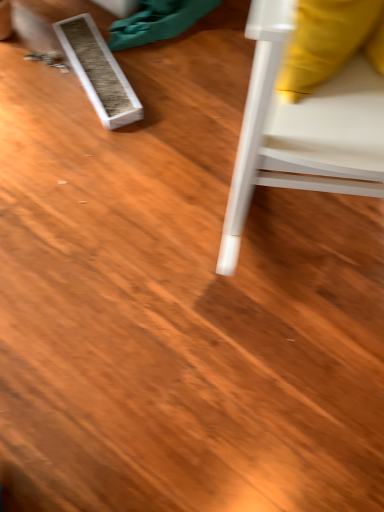
Question: Is white plastic chair at right outside white textured box at upper left?

Choices:
 (A) no
 (B) yes

Answer: (B)

Question: Could you tell me if white plastic chair at right is facing white textured box at upper left?

Choices:
 (A) no
 (B) yes

Answer: (A)

Question: Does white plastic chair at right have a smaller size compared to white textured box at upper left?

Choices:
 (A) yes
 (B) no

Answer: (B)

Question: Considering the relative positions of white plastic chair at right and white textured box at upper left in the image provided, is white plastic chair at right to the right of white textured box at upper left from the viewer's perspective?

Choices:
 (A) yes
 (B) no

Answer: (A)

Question: From a real-world perspective, does white plastic chair at right sit lower than white textured box at upper left?

Choices:
 (A) no
 (B) yes

Answer: (A)

Question: Is white plastic chair at right oriented away from white textured box at upper left?

Choices:
 (A) no
 (B) yes

Answer: (A)

Question: Is the surface of white textured box at upper left in direct contact with white plastic chair at right?

Choices:
 (A) yes
 (B) no

Answer: (B)

Question: Does white textured box at upper left come in front of white plastic chair at right?

Choices:
 (A) yes
 (B) no

Answer: (B)

Question: Considering the relative sizes of white textured box at upper left and white plastic chair at right in the image provided, is white textured box at upper left wider than white plastic chair at right?

Choices:
 (A) yes
 (B) no

Answer: (B)

Question: Is white textured box at upper left further to camera compared to white plastic chair at right?

Choices:
 (A) yes
 (B) no

Answer: (A)

Question: Can you confirm if white textured box at upper left is thinner than white plastic chair at right?

Choices:
 (A) no
 (B) yes

Answer: (B)

Question: Can you confirm if white textured box at upper left is shorter than white plastic chair at right?

Choices:
 (A) no
 (B) yes

Answer: (B)

Question: Based on their positions, is white textured box at upper left located to the left or right of white plastic chair at right?

Choices:
 (A) right
 (B) left

Answer: (B)